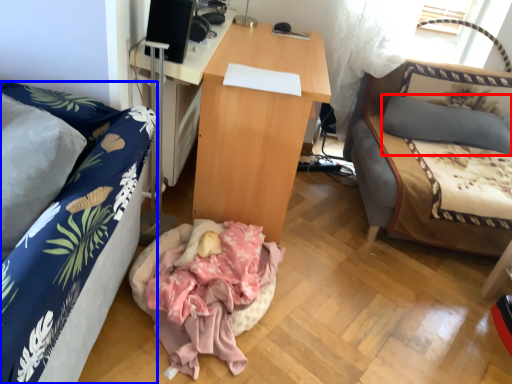
Question: Which object appears closest to the camera in this image, pillow (highlighted by a red box) or studio couch (highlighted by a blue box)?

Choices:
 (A) pillow
 (B) studio couch

Answer: (B)